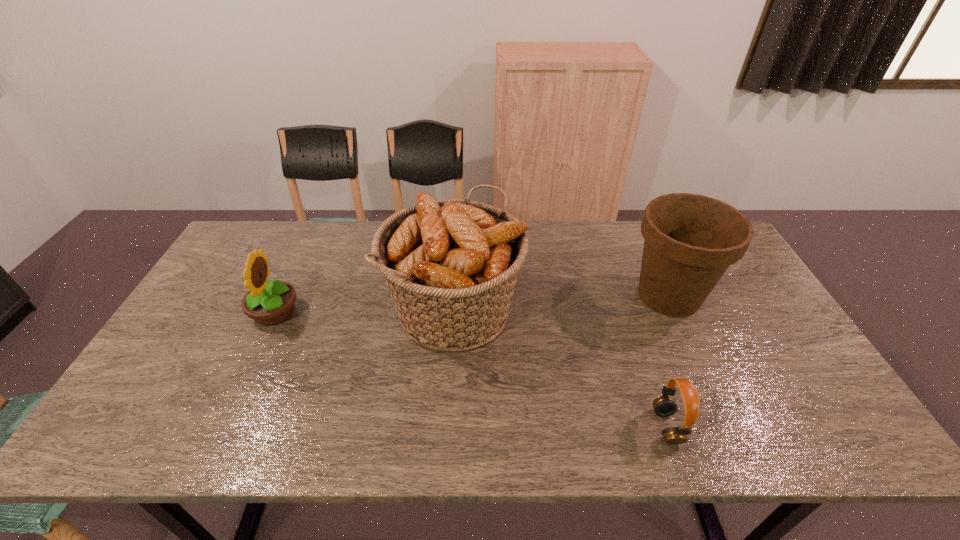
You are a GUI agent. You are given a task and a screenshot of the screen. Output one action in this format:
    pyautogui.click(x=<x>, y=<y>)
    Task: Click on the free region located 0.140m on the ear cups of the nearest object
    Image resolution: width=960 pixels, height=540 pixels.
    Given the screenshot: What is the action you would take?
    pyautogui.click(x=594, y=427)

Find the location of `free region located on the ear cups of the nearest object`. free region located on the ear cups of the nearest object is located at coordinates (586, 427).

Identify the location of object present at the far edge. (451, 265).

The image size is (960, 540). What are the coordinates of `object situated at the near edge` in the screenshot? It's located at (664, 406).

At what (x,y) coordinates should I click in order to perform the action: click on object at the right edge. Please return your answer as a coordinate pair (x, y). Looking at the image, I should click on (690, 240).

Where is `vacant space at the far edge of the desktop`? vacant space at the far edge of the desktop is located at coordinates (354, 245).

The width and height of the screenshot is (960, 540). In order to click on vacant space at the near edge of the desktop in this screenshot , I will do `click(450, 442)`.

In the image, there is a desktop. Where is `vacant space at the left edge`? The image size is (960, 540). vacant space at the left edge is located at coordinates (194, 348).

In the image, there is a desktop. At what (x,y) coordinates should I click in order to perform the action: click on free space at the far left corner. Please return your answer as a coordinate pair (x, y). Image resolution: width=960 pixels, height=540 pixels. Looking at the image, I should click on (252, 234).

Locate an element on the screen. vacant area at the near right corner of the desktop is located at coordinates (825, 439).